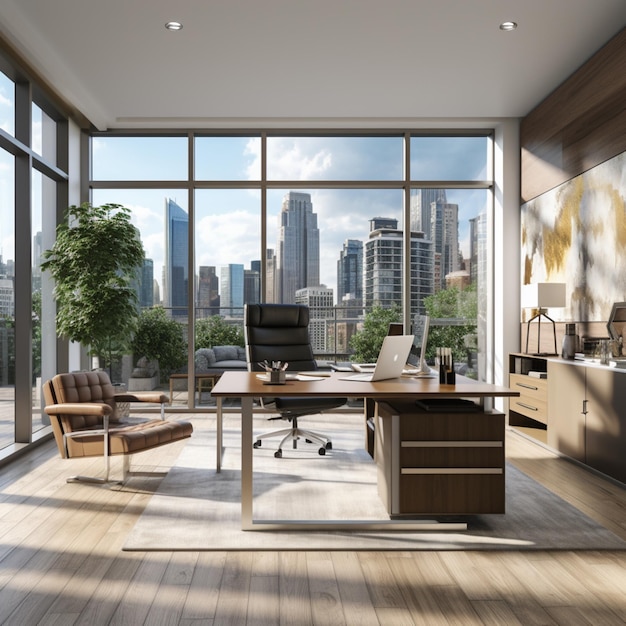
Locate an element on the screen. This screenshot has height=626, width=626. hardwood floor is located at coordinates (47, 503), (120, 605), (464, 591), (573, 496).